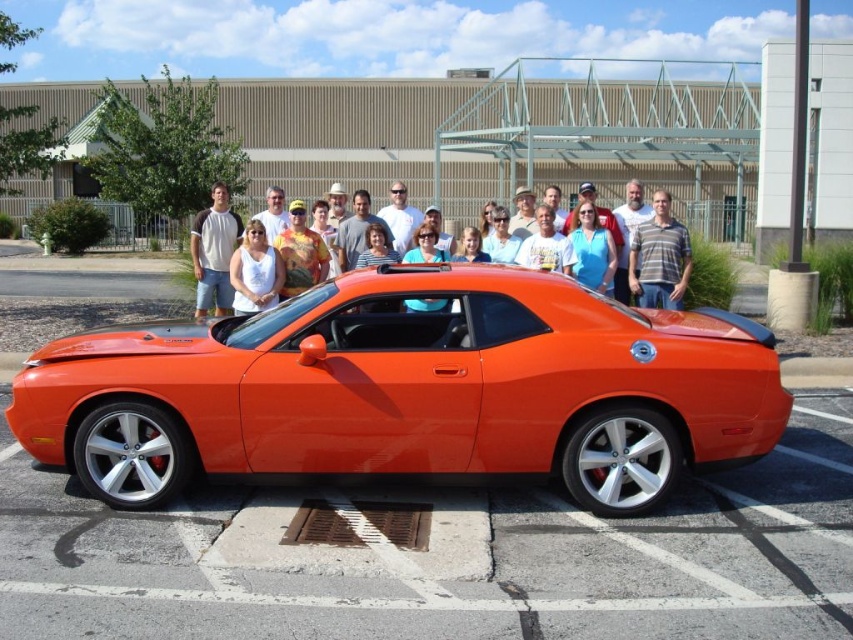
Between point (85, 572) and point (654, 220), which one is positioned in front?

Point (85, 572) is more forward.

Is point (146, 541) closer to camera compared to point (656, 216)?

Yes, point (146, 541) is closer to viewer.

At what (x,y) coordinates should I click in order to perform the action: click on glossy orange car at center. Please return your answer as a coordinate pair (x, y). The image size is (853, 640). Looking at the image, I should click on (444, 557).

Is glossy orange sports car at center thinner than matte orange car at center?

Incorrect, glossy orange sports car at center's width is not less than matte orange car at center's.

Between point (41, 428) and point (198, 316), which one is positioned behind?

Point (198, 316)

The image size is (853, 640). What are the coordinates of `glossy orange sports car at center` in the screenshot? It's located at (409, 388).

Can you confirm if glossy orange car at center is positioned to the right of matte orange car at center?

Yes, glossy orange car at center is to the right of matte orange car at center.

Who is taller, glossy orange car at center or matte orange car at center?

matte orange car at center

Which is behind, point (277, 536) or point (326, 268)?

The point (326, 268) is more distant.

In order to click on glossy orange car at center in this screenshot , I will do `click(444, 557)`.